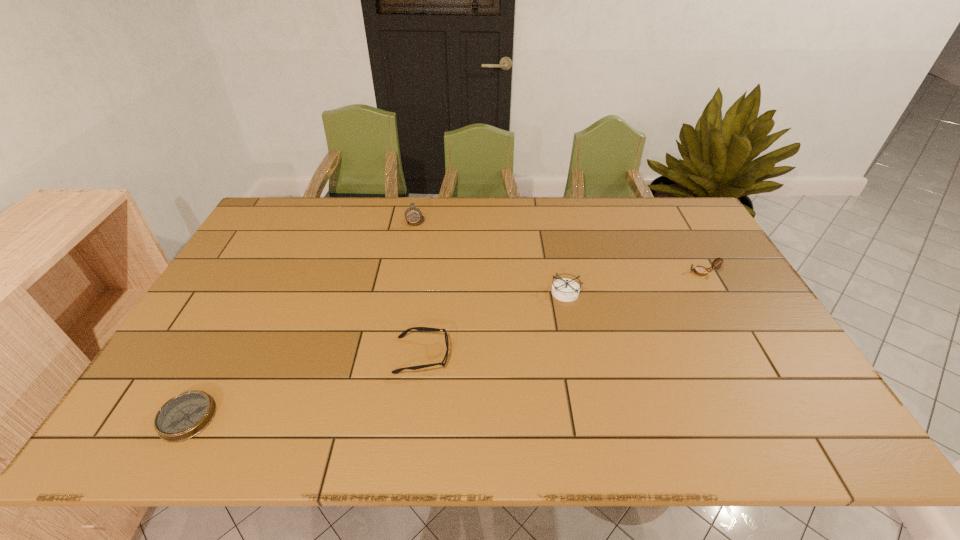
Identify the location of free location located 0.230m on the face of the farthest object. (406, 272).

The width and height of the screenshot is (960, 540). Identify the location of vacant space located 0.160m on the left of the second object from right to left. (495, 292).

Locate an element on the screen. This screenshot has height=540, width=960. free space located on the face of the second farthest compass is located at coordinates pyautogui.click(x=615, y=272).

Where is `free location located on the face of the second farthest compass`? free location located on the face of the second farthest compass is located at coordinates (572, 272).

Where is `vacant space situated 0.170m on the face of the second farthest compass`? This screenshot has width=960, height=540. vacant space situated 0.170m on the face of the second farthest compass is located at coordinates (632, 272).

Locate an element on the screen. free location located 0.140m on the front-facing side of the fourth tallest object is located at coordinates (505, 355).

Where is `vacant space located 0.090m on the back of the nearest object`? This screenshot has height=540, width=960. vacant space located 0.090m on the back of the nearest object is located at coordinates (217, 363).

The height and width of the screenshot is (540, 960). I want to click on object that is positioned at the far edge, so click(x=414, y=217).

I want to click on object that is at the near edge, so click(182, 417).

Find the location of `object situated at the left edge`. object situated at the left edge is located at coordinates (182, 417).